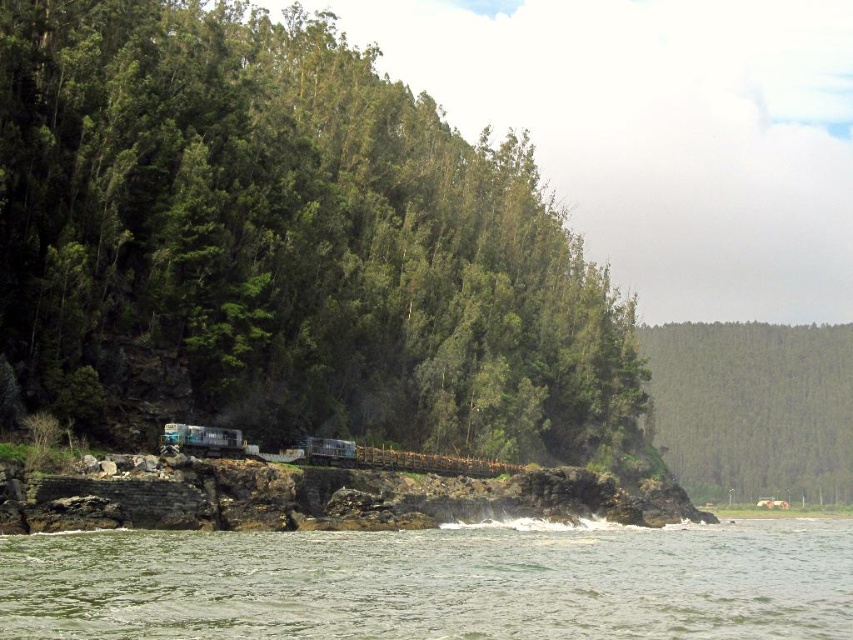
Between clear water at lower left and green leafy forest at upper right, which one is positioned higher?

clear water at lower left is above.

Does point (608, 593) come in front of point (747, 326)?

Yes.

Is point (453, 554) in front of point (695, 492)?

Yes, it is.

The image size is (853, 640). I want to click on clear water at lower left, so click(x=434, y=582).

This screenshot has height=640, width=853. What do you see at coordinates (285, 244) in the screenshot? I see `green leafy trees at left` at bounding box center [285, 244].

Which is behind, point (245, 184) or point (310, 448)?

Point (245, 184)

The image size is (853, 640). I want to click on green leafy trees at left, so click(285, 244).

Is green leafy forest at upper right shorter than teal glossy recreational vehicle at center?

No, green leafy forest at upper right is not shorter than teal glossy recreational vehicle at center.

Does green leafy forest at upper right come behind teal glossy recreational vehicle at center?

Yes, it is.

Which is behind, point (801, 364) or point (212, 429)?

The point (801, 364) is behind.

At what (x,y) coordinates should I click in order to perform the action: click on green leafy forest at upper right. Please return your answer as a coordinate pair (x, y). This screenshot has width=853, height=640. Looking at the image, I should click on (752, 408).